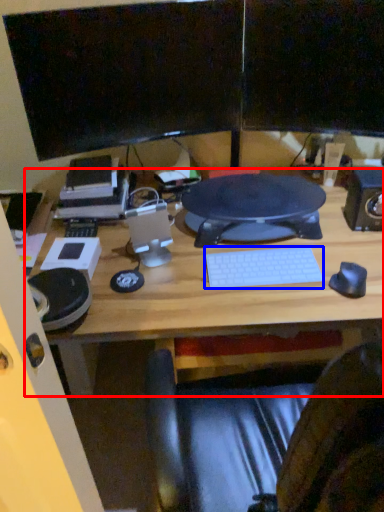
Question: Which object is closer to the camera taking this photo, desk (highlighted by a red box) or computer keyboard (highlighted by a blue box)?

Choices:
 (A) desk
 (B) computer keyboard

Answer: (A)